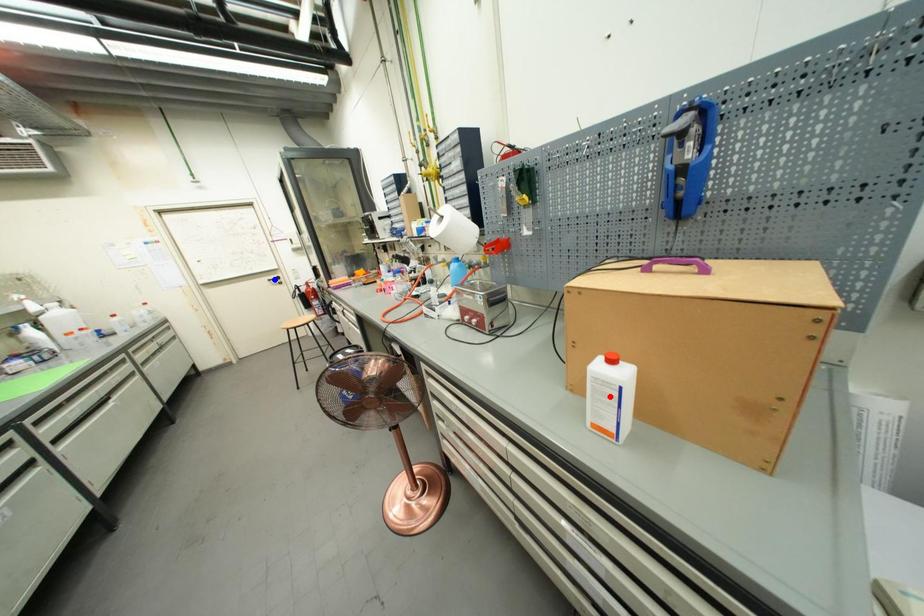
Question: Two points are marked on the image. Which point is closer to the camera?

Choices:
 (A) Blue point is closer.
 (B) Red point is closer.

Answer: (B)